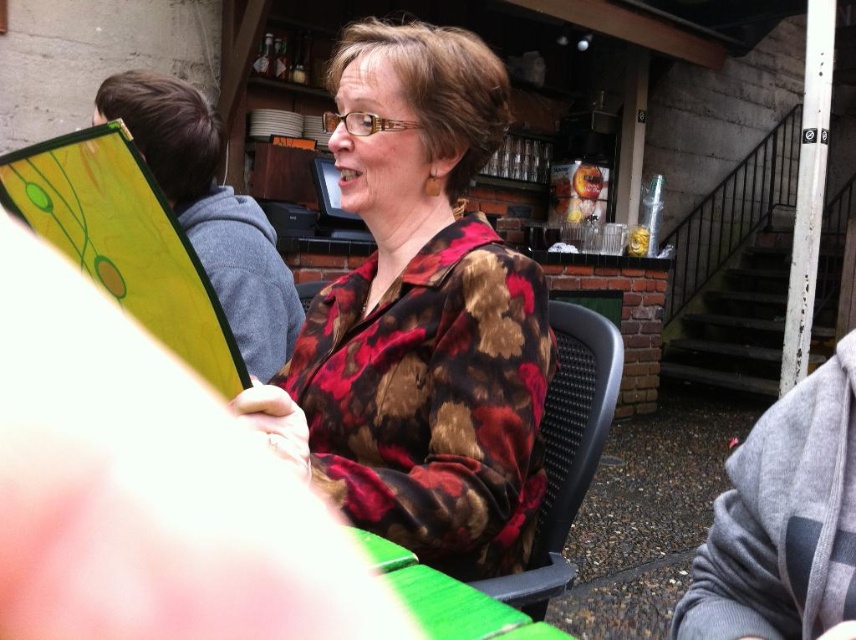
You are standing in the outdoor area of a cafe and see two points marked on the ground. The first point is at coordinate point(501, 428) and the second is at point(572, 342). Which point is closer to you?

Point(501, 428) is closer to the viewer than point(572, 342).